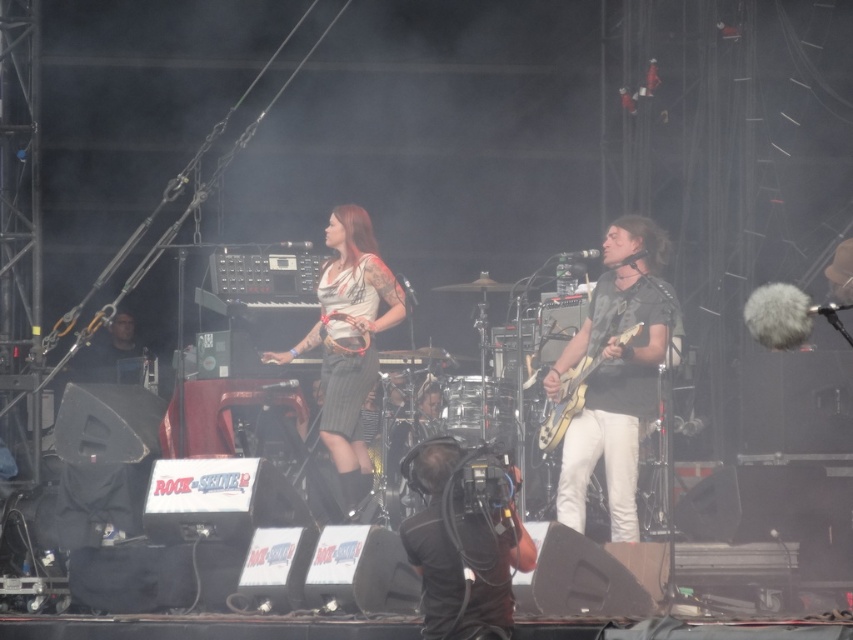
You are a stagehand at the concert venue. You need to quickly retrieve the black fabric camera at lower center during a performance break. However, the black matte guitar at right is blocking your path. Can you easily access the camera without moving the guitar?

The black matte guitar at right is positioned over the black fabric camera at lower center, which means the guitar is covering the camera. Therefore, you cannot easily access the camera without moving the guitar.

You are a stagehand who needs to retrieve the black matte guitar at right quickly. You are currently standing 10 meters away from the stage. Can you reach the guitar before the next song starts in 30 seconds? Assume you can move at 3 meters per second.

The black matte guitar at right is 7.62 meters away from the viewer. Since you are 10 meters away from the stage, the total distance to the guitar is 10 meters plus 7.62 meters, totaling 17.62 meters. Moving at 3 meters per second, it would take approximately 5.87 seconds to reach it. Therefore, yes, you can reach the guitar before the next song starts in 30 seconds.

You are a photographer trying to capture the musician in the matte white shirt at center. There is a black fabric camera at lower center in your way. Can you adjust your position to avoid the camera and still see the musician?

The black fabric camera at lower center is in front of the matte white shirt at center, so moving to the side or adjusting your angle would allow you to see the musician without the camera blocking the view.